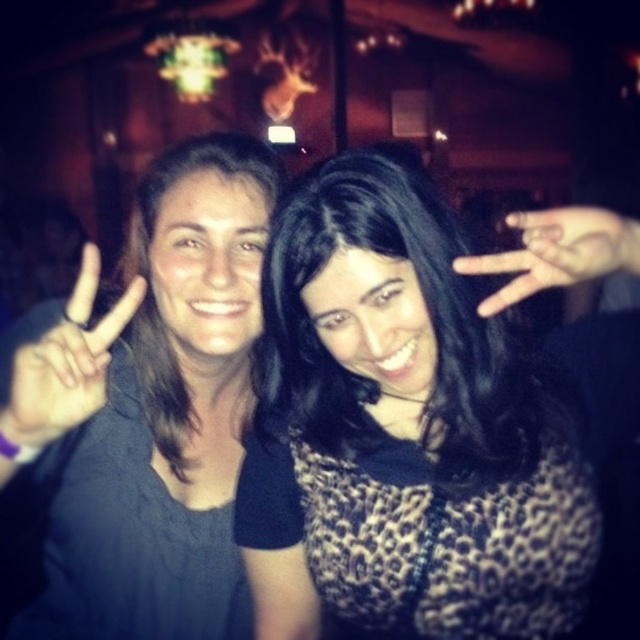
Is point (28, 396) in front of point (483, 304)?

Yes, it is in front of point (483, 304).

Is black matte hand at left positioned behind matte black hand at center?

Yes, it is behind matte black hand at center.

The image size is (640, 640). Find the location of `black matte hand at left`. black matte hand at left is located at coordinates (67, 362).

Where is `black matte hand at left`? black matte hand at left is located at coordinates [x=67, y=362].

Is leopard print top at center shorter than black matte hand at left?

No, leopard print top at center is not shorter than black matte hand at left.

Where is `leopard print top at center`? Image resolution: width=640 pixels, height=640 pixels. leopard print top at center is located at coordinates (403, 433).

Does point (168, 371) come closer to viewer compared to point (104, 378)?

No, (168, 371) is behind (104, 378).

How far apart are dark gray sweater at left and black matte hand at left?

dark gray sweater at left is 6.11 inches away from black matte hand at left.

This screenshot has height=640, width=640. Identify the location of dark gray sweater at left. (147, 408).